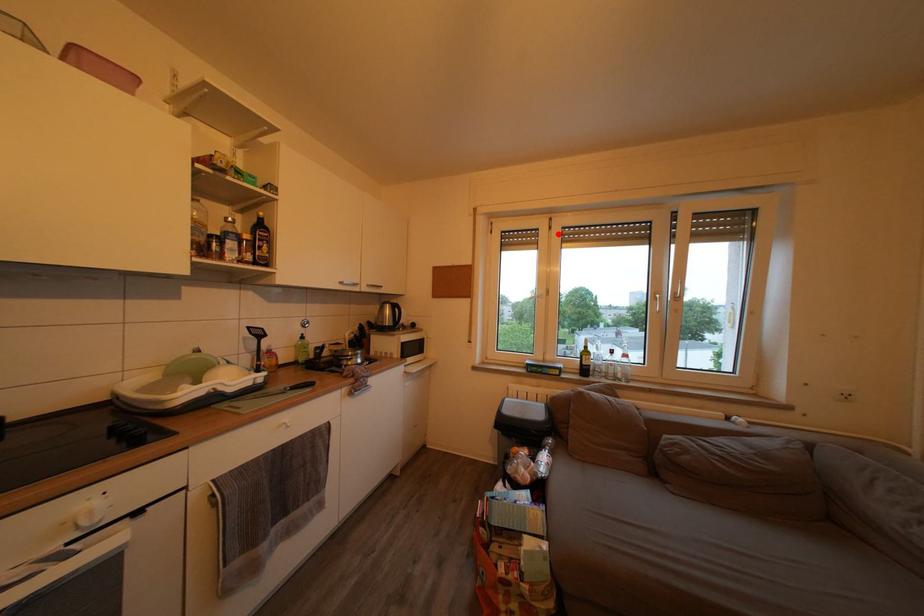
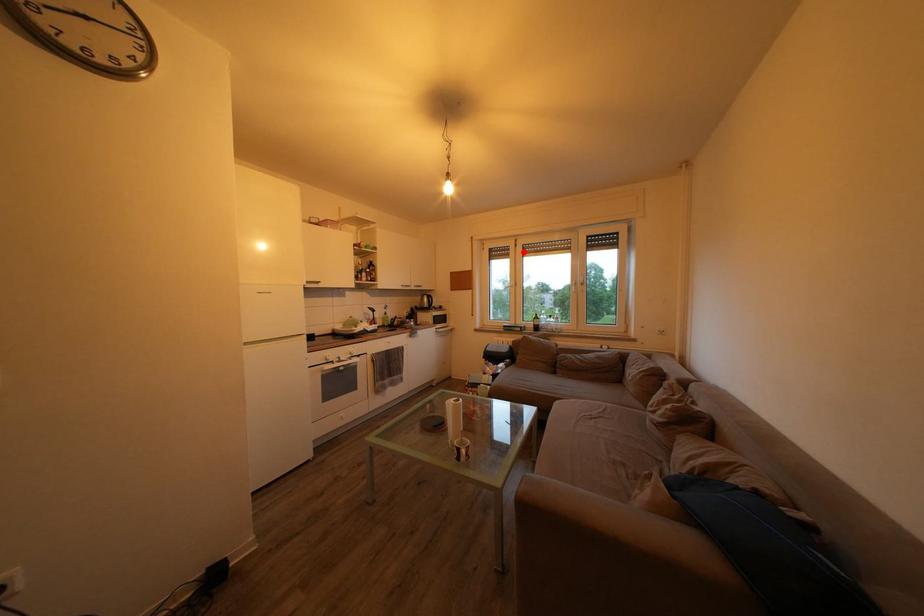
I am providing you with two images of the same scene from different viewpoints. A red point is marked on the first image and another point is marked on the second image. Are the points marked in image1 and image2 representing the same 3D position?

Yes